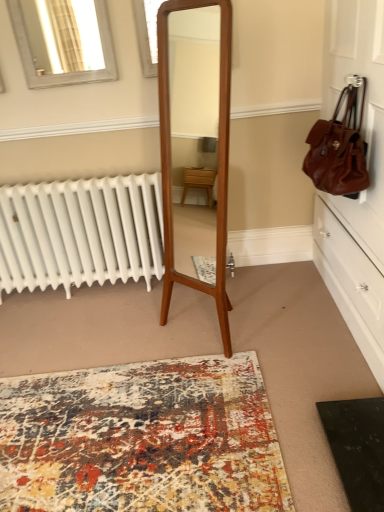
Question: In terms of size, does matte brown leather dresser at right appear bigger or smaller than silver metallic window at upper left, the second window positioned from the right?

Choices:
 (A) big
 (B) small

Answer: (A)

Question: Is matte brown leather dresser at right wider or thinner than silver metallic window at upper left, the second window positioned from the right?

Choices:
 (A) wide
 (B) thin

Answer: (A)

Question: Which is nearer to the textured multicolor rug at center?

Choices:
 (A) brown leather handbag at upper right
 (B) matte brown leather dresser at right
 (C) matte glass window at upper center, which is counted as the second window, starting from the left
 (D) silver metallic window at upper left, which is the first window from left to right

Answer: (B)

Question: Which object is positioned farthest from the brown leather handbag at upper right?

Choices:
 (A) matte brown leather dresser at right
 (B) textured multicolor rug at center
 (C) matte glass window at upper center, which is counted as the second window, starting from the left
 (D) silver metallic window at upper left, which is the first window from left to right

Answer: (D)